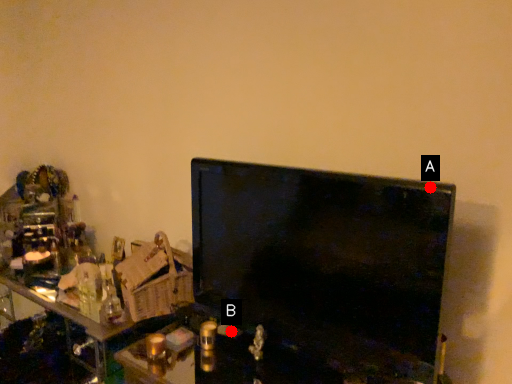
Question: Two points are circled on the image, labeled by A and B beside each circle. Which point is farther from the camera taking this photo?

Choices:
 (A) A is further
 (B) B is further

Answer: (B)